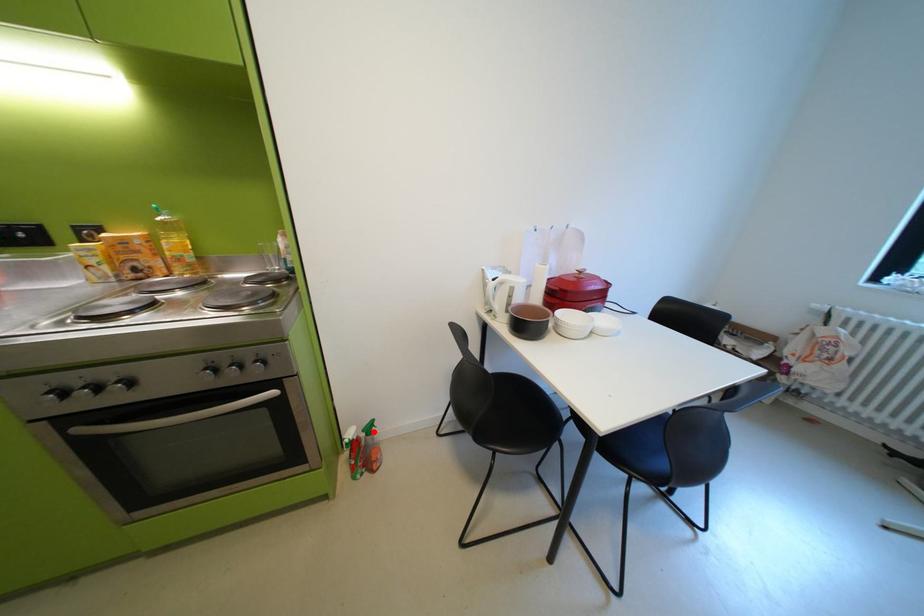
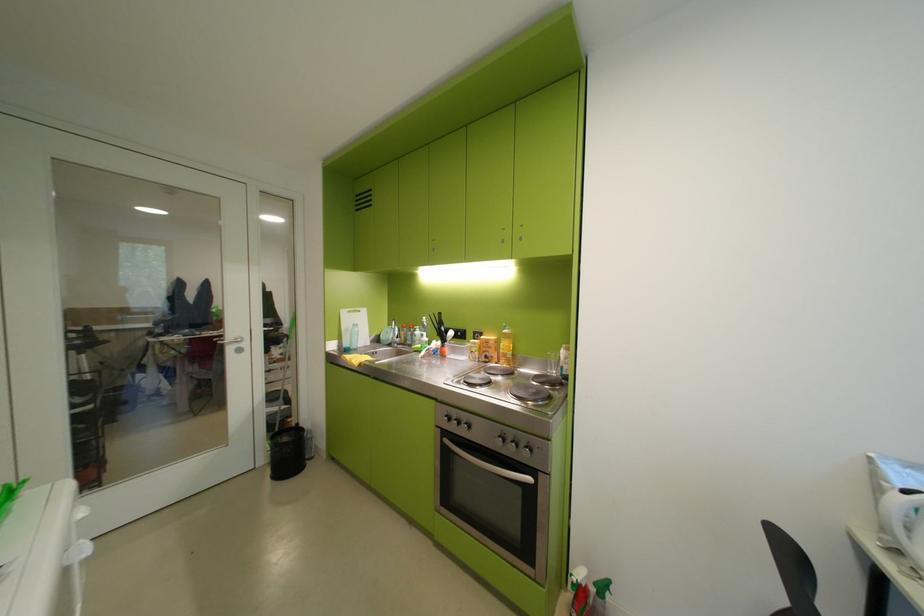
Locate, in the second image, the point that corresponds to the highlighted location in the first image.

(604, 585)